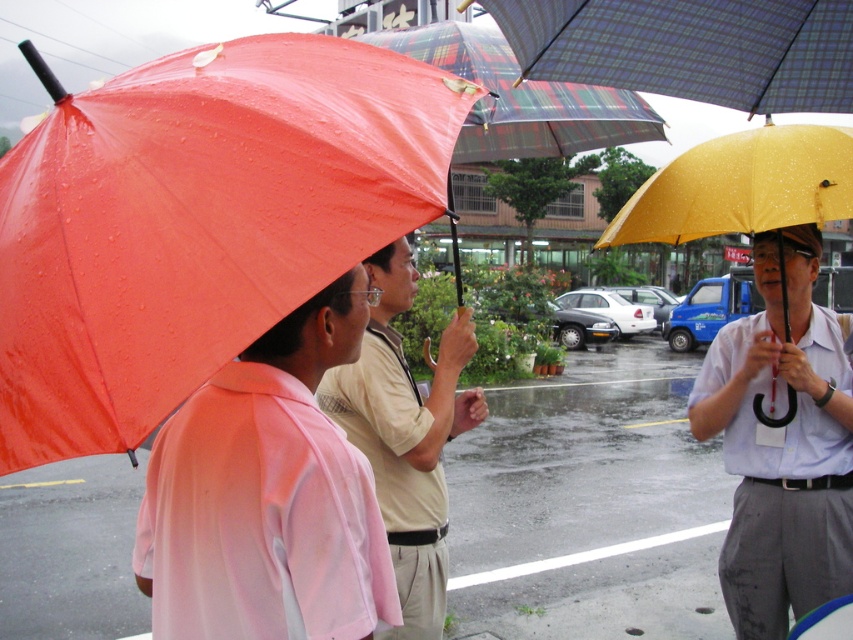
Question: Observing the image, what is the correct spatial positioning of plaid fabric umbrella at upper center in reference to matte beige shirt at center?

Choices:
 (A) right
 (B) left

Answer: (A)

Question: Which point is closer to the camera?

Choices:
 (A) (53, 125)
 (B) (726, 170)
 (C) (462, 420)
 (D) (547, 74)

Answer: (A)

Question: Can you confirm if pink matte shirt at center is positioned to the right of matte yellow umbrella at center?

Choices:
 (A) no
 (B) yes

Answer: (A)

Question: Among these points, which one is farthest from the camera?

Choices:
 (A) (706, 212)
 (B) (506, 16)
 (C) (721, 417)

Answer: (C)

Question: Considering the real-world distances, which object is farthest from the matte yellow umbrella at center?

Choices:
 (A) pink matte shirt at center
 (B) matte beige shirt at center
 (C) plaid fabric umbrella at upper center

Answer: (A)

Question: Is pink matte shirt at center further to the viewer compared to yellow matte umbrella at right?

Choices:
 (A) yes
 (B) no

Answer: (B)